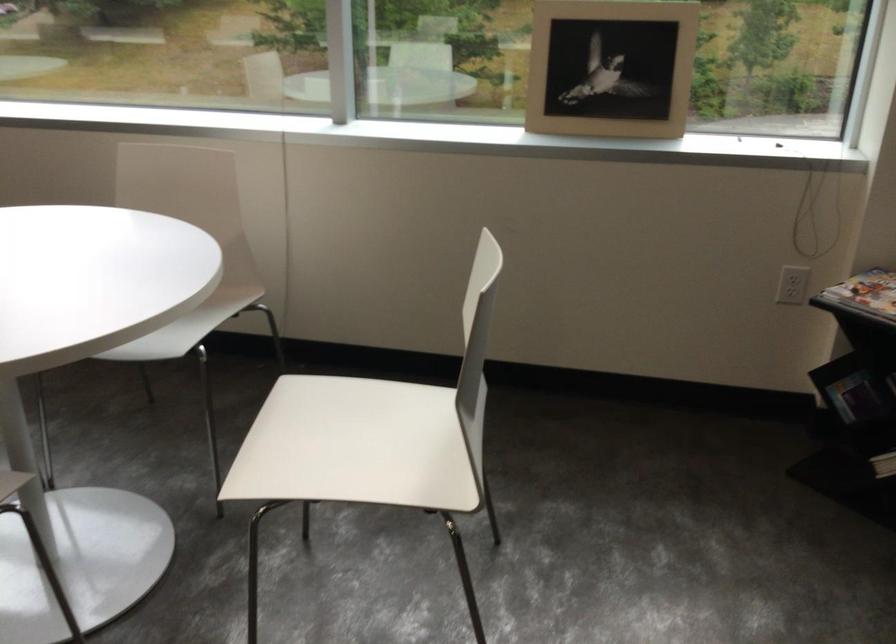
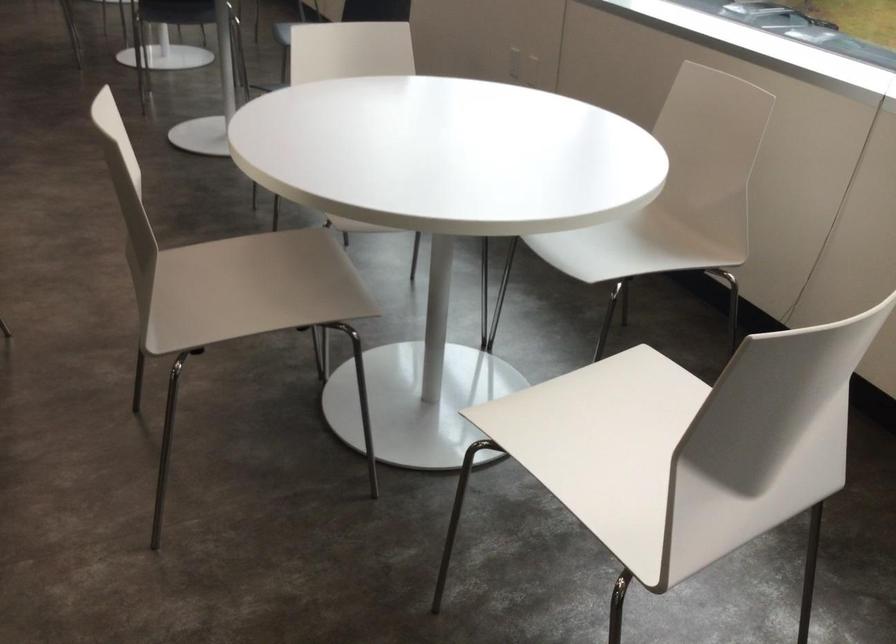
Question: The first image is from the beginning of the video and the second image is from the end. How did the camera likely rotate when shooting the video?

Choices:
 (A) Left
 (B) Right
 (C) Up
 (D) Down

Answer: (A)